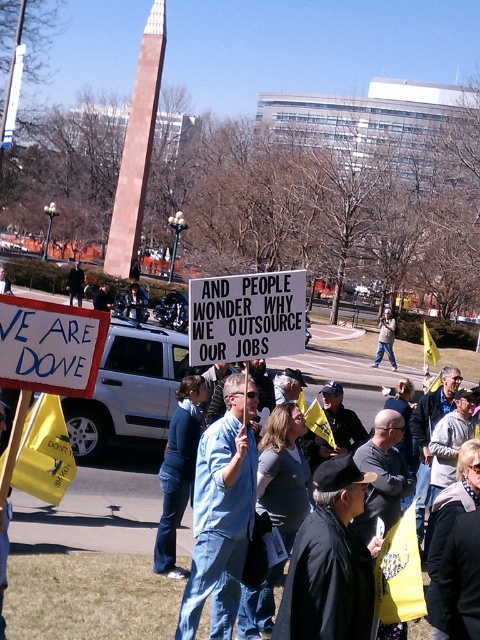
Question: Can you confirm if white paper sign at center is thinner than denim jacket at center?

Choices:
 (A) no
 (B) yes

Answer: (A)

Question: Which of the following is the farthest from the observer?

Choices:
 (A) white paper sign at center
 (B) white cardboard sign at center
 (C) denim jacket at center
 (D) blue denim shirt at center

Answer: (C)

Question: Does blue denim shirt at center have a greater width compared to denim jacket at center?

Choices:
 (A) no
 (B) yes

Answer: (B)

Question: Which object is positioned farthest from the white paper sign at center?

Choices:
 (A) blue denim shirt at center
 (B) white cardboard sign at center

Answer: (B)

Question: Can you confirm if blue denim shirt at center is smaller than white paper sign at center?

Choices:
 (A) yes
 (B) no

Answer: (B)

Question: Considering the real-world distances, which object is closest to the denim jacket at center?

Choices:
 (A) white cardboard sign at center
 (B) white paper sign at center
 (C) blue denim shirt at center

Answer: (C)